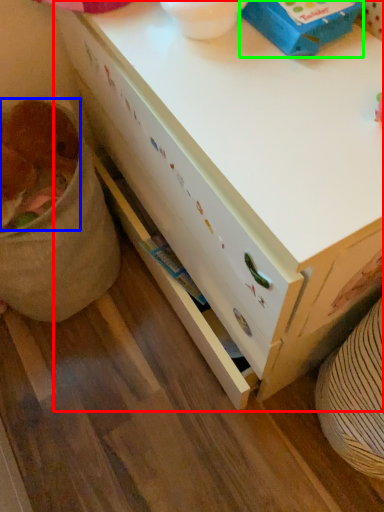
Question: Considering the real-world distances, which object is closest to desk (highlighted by a red box)? animal (highlighted by a blue box) or box (highlighted by a green box).

Choices:
 (A) animal
 (B) box

Answer: (B)